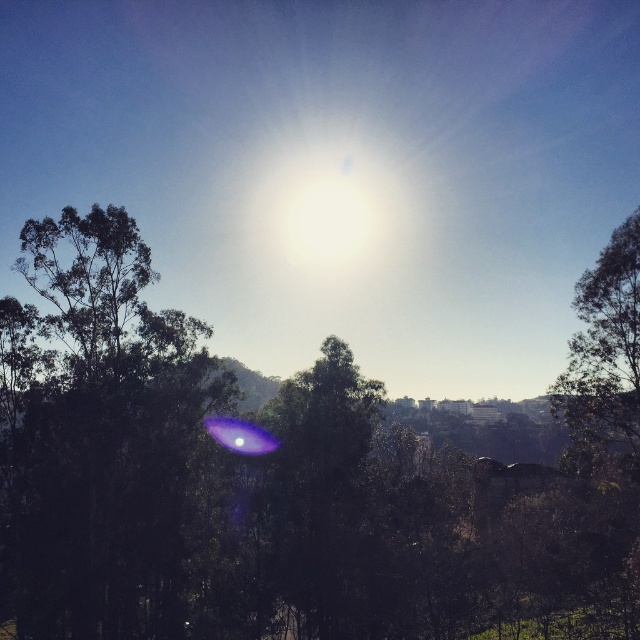
Question: From the image, what is the correct spatial relationship of green leafy tree at upper left in relation to green leafy tree at right?

Choices:
 (A) right
 (B) left

Answer: (B)

Question: Is green leafy tree at center bigger than green leafy tree at right?

Choices:
 (A) no
 (B) yes

Answer: (B)

Question: Among these points, which one is farthest from the camera?

Choices:
 (A) (276, 492)
 (B) (616, 332)

Answer: (A)

Question: Can you confirm if green leafy tree at center is positioned to the right of green leafy tree at right?

Choices:
 (A) no
 (B) yes

Answer: (A)

Question: Estimate the real-world distances between objects in this image. Which object is closer to the green leafy tree at upper left?

Choices:
 (A) green leafy tree at right
 (B) green leafy tree at center

Answer: (B)

Question: Which point is farther to the camera?

Choices:
 (A) (68, 588)
 (B) (580, 380)
 (C) (163, 556)

Answer: (B)